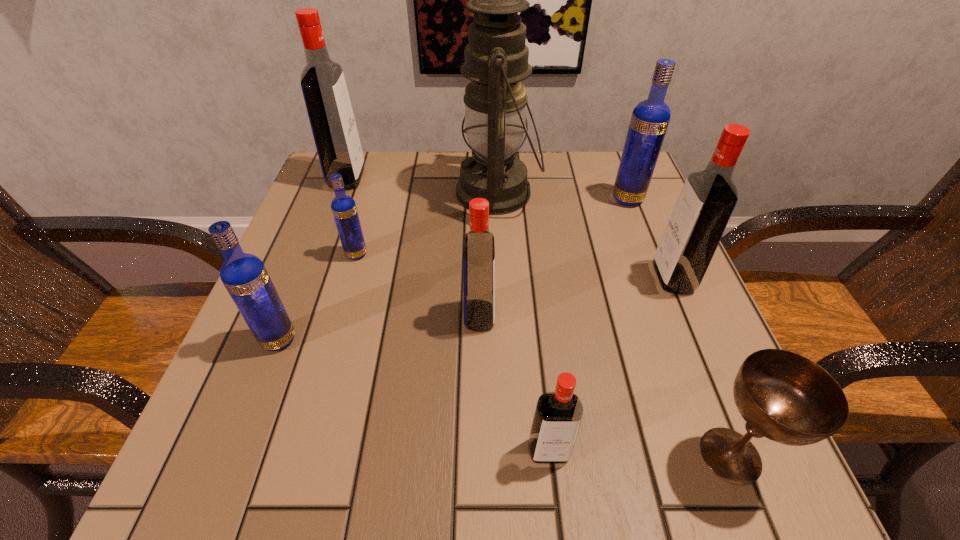
Identify the location of vacant space located on the front and back of the rightmost red vodka. (452, 278).

This screenshot has width=960, height=540. Find the location of `vacant space located 0.370m on the front and back of the rightmost red vodka`. vacant space located 0.370m on the front and back of the rightmost red vodka is located at coordinates (458, 278).

In order to click on vacant area situated on the front of the nearest blue vodka in this screenshot , I will do tap(248, 419).

Locate an element on the screen. The height and width of the screenshot is (540, 960). vacant space situated 0.350m on the front and back of the third red vodka from right to left is located at coordinates (697, 316).

Identify the location of blank space located on the left of the second blue vodka from left to right. This screenshot has width=960, height=540. (320, 254).

The width and height of the screenshot is (960, 540). Find the location of `vacant region located on the left of the chalice`. vacant region located on the left of the chalice is located at coordinates (477, 455).

Identify the location of oil lamp located at the far edge. Image resolution: width=960 pixels, height=540 pixels. (496, 58).

Where is `vodka located at the near edge`? Image resolution: width=960 pixels, height=540 pixels. vodka located at the near edge is located at coordinates (558, 415).

In order to click on chalice situated at the near edge in this screenshot , I will do `click(783, 396)`.

Find the location of `chalice at the right edge`. chalice at the right edge is located at coordinates (783, 396).